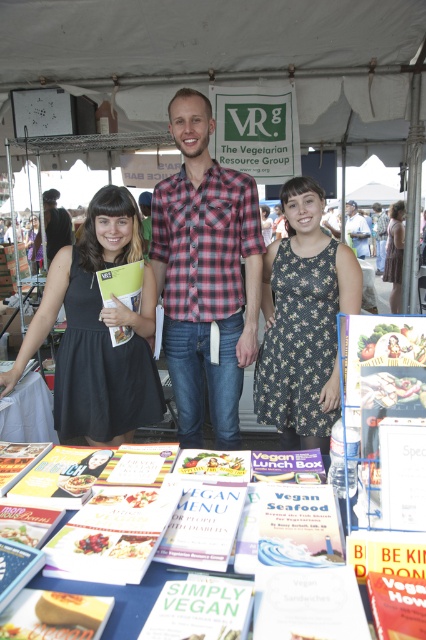
Question: Which object appears closest to the camera in this image?

Choices:
 (A) black dress at left
 (B) white paper book at center
 (C) floral-patterned dress at center

Answer: (B)

Question: Which point is closer to the camera?

Choices:
 (A) dark floral dress at center
 (B) plaid flannel shirt at center
 (C) white paper book at center
 (D) smooth red berries at center

Answer: (C)

Question: Is black dress at left closer to camera compared to checkered fabric shirt at center?

Choices:
 (A) no
 (B) yes

Answer: (B)

Question: Which of the following is the farthest from the observer?

Choices:
 (A) (348, 220)
 (B) (63, 218)
 (C) (189, 113)

Answer: (A)

Question: Observing the image, what is the correct spatial positioning of dark floral dress at center in reference to white paper book at lower left?

Choices:
 (A) above
 (B) below

Answer: (A)

Question: Is black dress at left above dark floral dress at center?

Choices:
 (A) yes
 (B) no

Answer: (B)